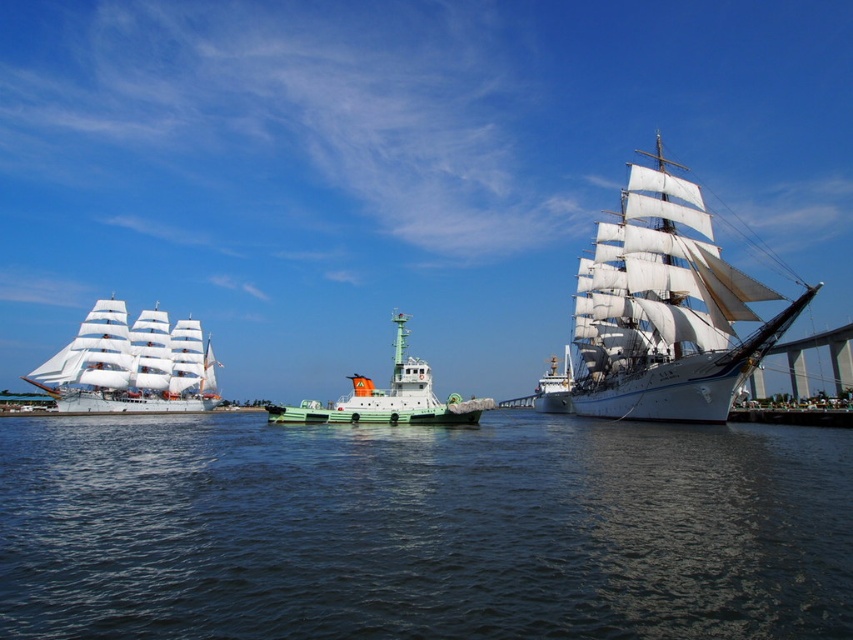
You are a sailor on the green matte tugboat at center. You need to navigate to the nearest dock located at the edge of the image. Which direction should you steer to avoid the dark blue water at center?

The dark blue water at center is positioned on the right side of green matte tugboat at center, so to avoid it, you should steer to the left.